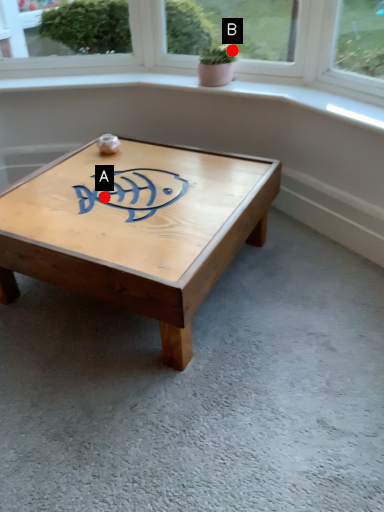
Question: Two points are circled on the image, labeled by A and B beside each circle. Which of the following is the farthest from the observer?

Choices:
 (A) A is further
 (B) B is further

Answer: (B)